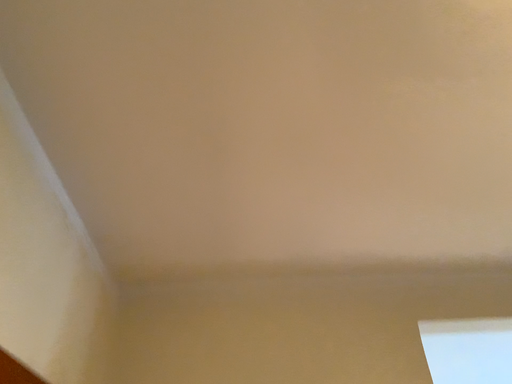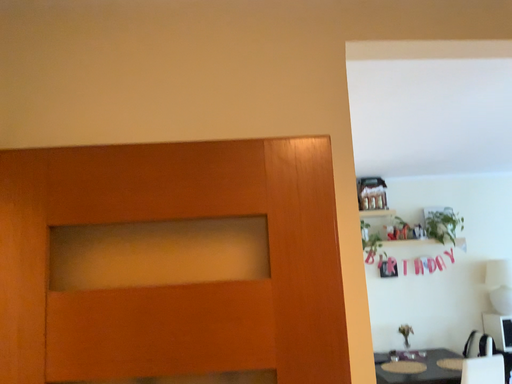
Question: Which way did the camera rotate in the video?

Choices:
 (A) rotated downward
 (B) rotated upward

Answer: (A)